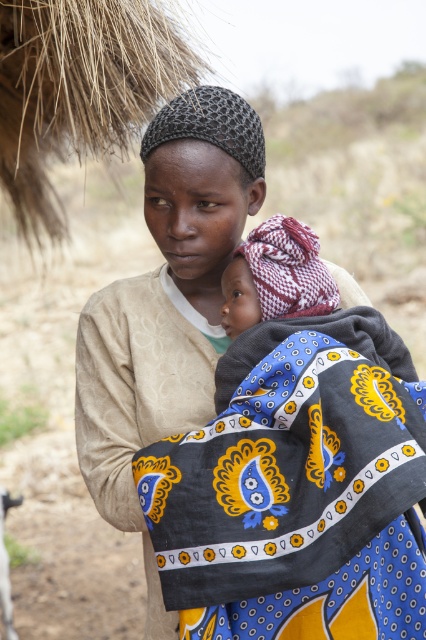
You are taking a photo of the scene and want to focus on both the point at coordinates point (x=192, y=618) and point (x=267, y=544). Which point should you focus on first to ensure both are in focus?

You should focus on point (x=267, y=544) first because it is closer to you than point (x=192, y=618), which is further away. By focusing on the closer point, the further point will also be in focus due to the depth of field.